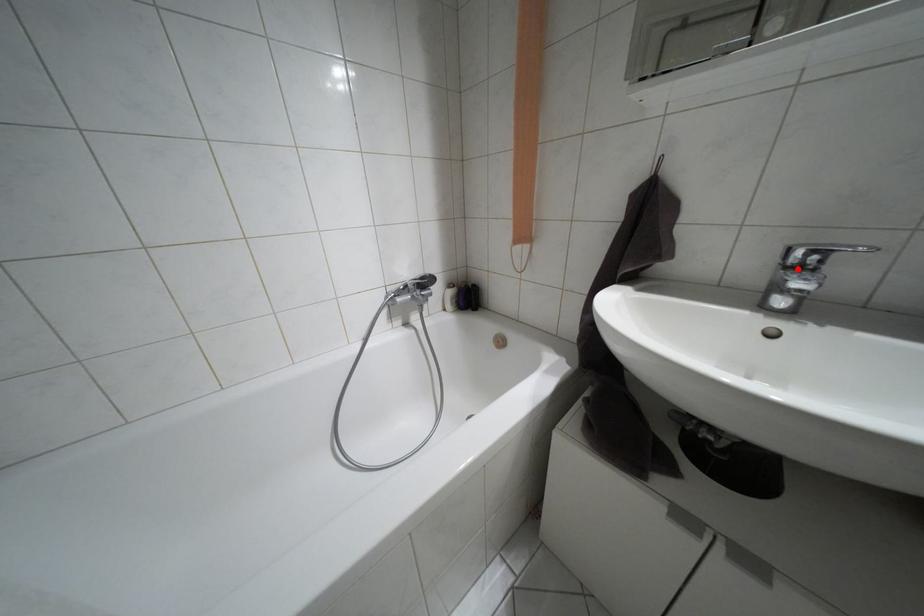
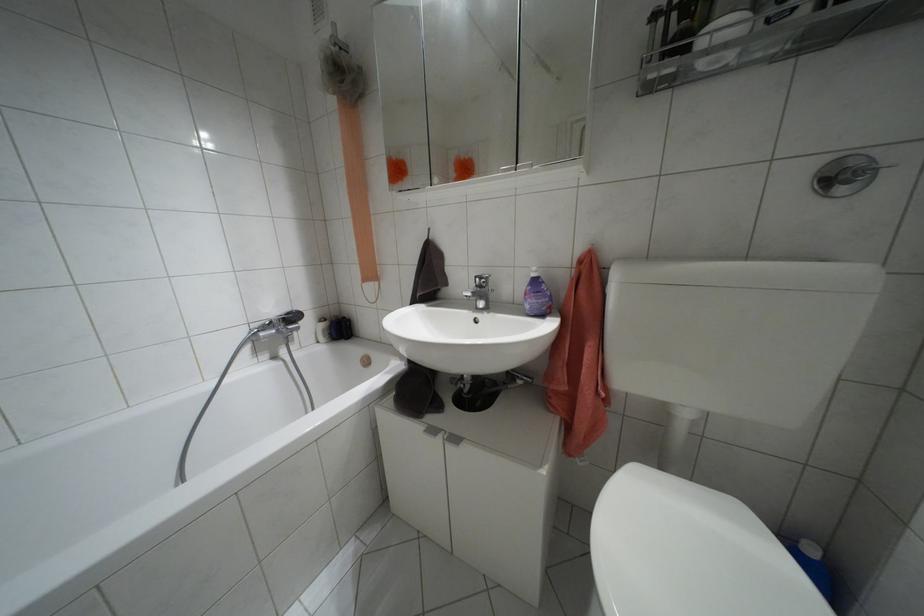
In the second image, find the point that corresponds to the highlighted location in the first image.

(479, 286)